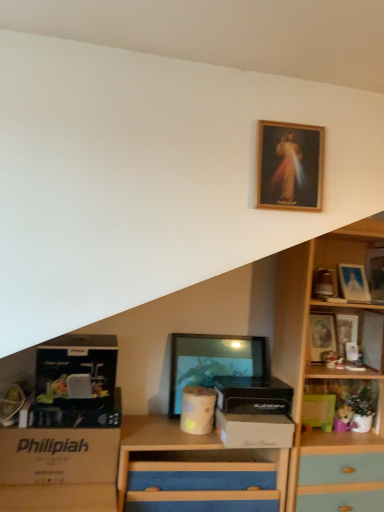
Question: Would you say wooden picture frame at upper right, placed as the 5th picture frame when sorted from back to front, is to the left or to the right of green matte box at lower right, the third box positioned from the left, in the picture?

Choices:
 (A) right
 (B) left

Answer: (A)

Question: Looking at the image, does wooden picture frame at upper right, placed as the 5th picture frame when sorted from back to front, seem bigger or smaller compared to green matte box at lower right, the third box positioned from the left?

Choices:
 (A) small
 (B) big

Answer: (B)

Question: Which object is positioned closest to the wooden picture frame at upper right, placed as the 5th picture frame when sorted from back to front?

Choices:
 (A) green matte box at lower right, the 1th box in the right-to-left sequence
 (B) matte gold picture frame at upper right, arranged as the fourth picture frame when viewed from the front
 (C) matte black picture frame at center, the 6th picture frame when ordered from right to left
 (D) wooden picture frame at upper center, the 6th picture frame positioned from the back
 (E) black plastic box at center, placed as the 2th box when sorted from bottom to top

Answer: (B)

Question: Estimate the real-world distances between objects in this image. Which object is farther from the white cardboard box at center, the 1th storage box when ordered from right to left?

Choices:
 (A) matte gold picture frame at upper right, arranged as the fourth picture frame when viewed from the front
 (B) white cardboard box at lower left, which is the second storage box from right to left
 (C) matte black picture frame at center, positioned as the 3th picture frame in front-to-back order
 (D) black plastic box at center, which is the second box from right to left
 (E) matte silver picture frame at upper right, the 5th picture frame from the left

Answer: (E)